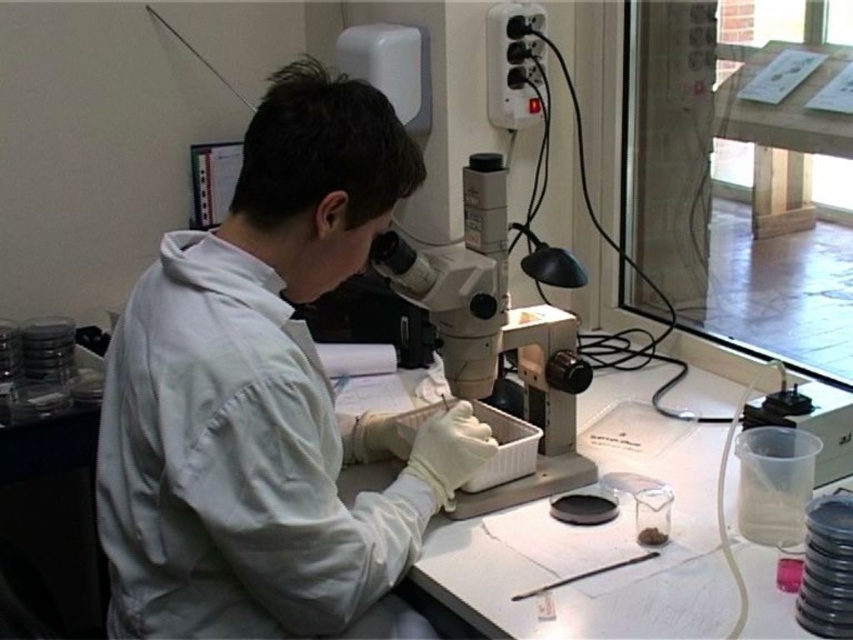
Between white matte lab coat at center and white plastic microscope at center, which one appears on the right side from the viewer's perspective?

From the viewer's perspective, white plastic microscope at center appears more on the right side.

Is white matte lab coat at center below white plastic microscope at center?

Indeed, white matte lab coat at center is positioned under white plastic microscope at center.

Does point (137, 456) come closer to viewer compared to point (537, 497)?

That is True.

Where is `white matte lab coat at center`? The image size is (853, 640). white matte lab coat at center is located at coordinates (265, 396).